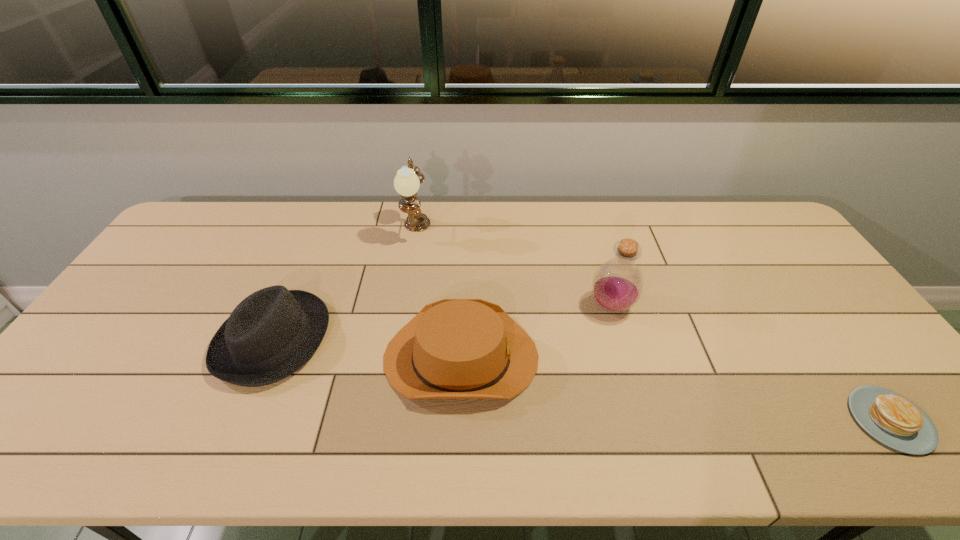
At what (x,y) coordinates should I click in order to perform the action: click on object that is the third closest one to the fedora. Please return your answer as a coordinate pair (x, y). The height and width of the screenshot is (540, 960). Looking at the image, I should click on (617, 285).

Find the location of a particular element. The image size is (960, 540). object that is the fourth closest to the tallest object is located at coordinates (891, 418).

What are the coordinates of `vacant space that satisfies the following two spatial constraints: 1. on the front-facing side of the cowboy hat; 2. on the right side of the pancake` in the screenshot? It's located at (459, 420).